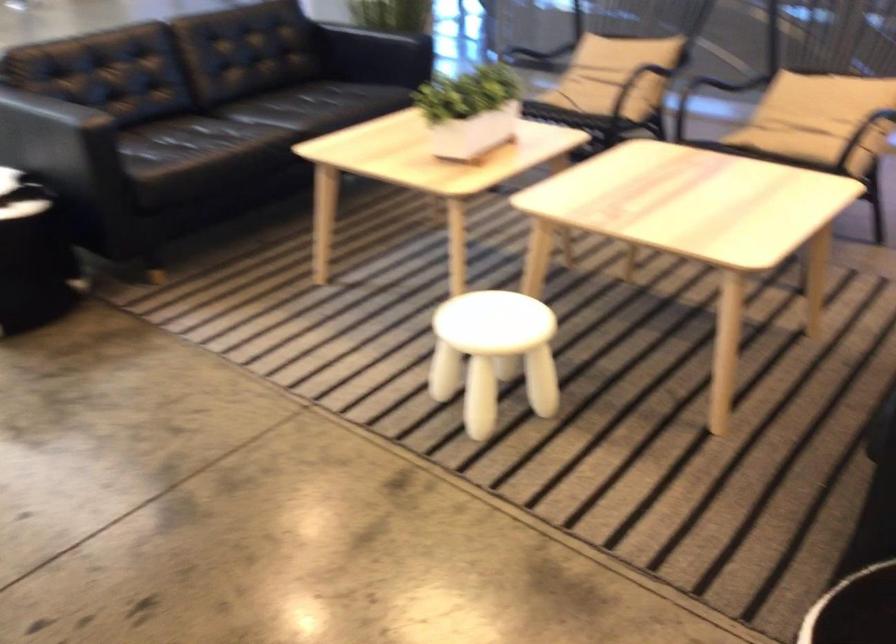
This screenshot has height=644, width=896. What do you see at coordinates (493, 354) in the screenshot?
I see `the white stool` at bounding box center [493, 354].